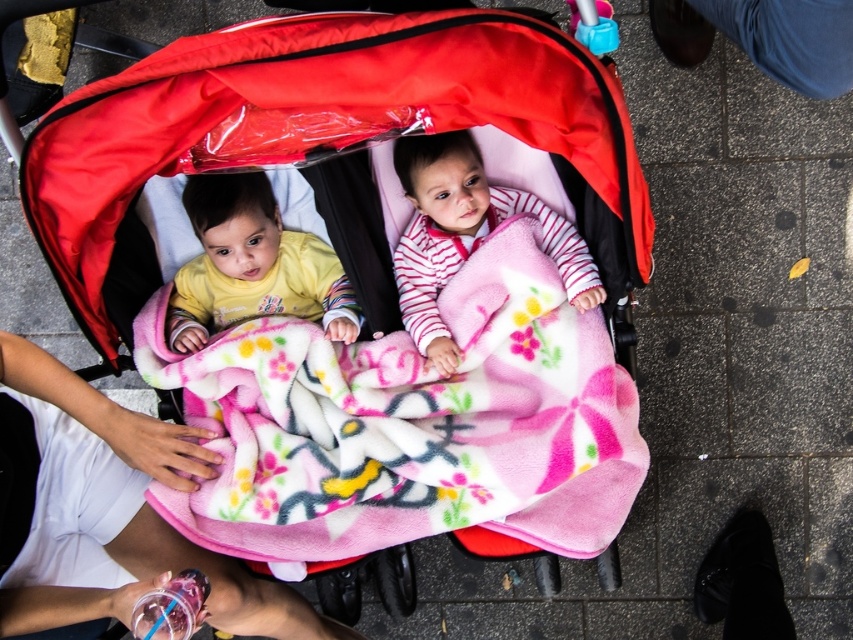
Does fluffy pink blanket at center appear on the left side of white fabric hand at lower left?

In fact, fluffy pink blanket at center is to the right of white fabric hand at lower left.

Can you confirm if fluffy pink blanket at center is positioned below white fabric hand at lower left?

Actually, fluffy pink blanket at center is above white fabric hand at lower left.

Who is more distant from viewer, (563, 404) or (154, 419)?

Positioned behind is point (563, 404).

Identify the location of fluffy pink blanket at center. (410, 422).

Is matte pink blanket at center closer to camera compared to yellow fleece toddler at upper left?

That is True.

Does point (490, 296) lie in front of point (190, 321)?

Yes, point (490, 296) is closer to viewer.

Is point (294, 481) positioned behind point (190, 344)?

No, it is not.

The height and width of the screenshot is (640, 853). I want to click on matte pink blanket at center, so click(366, 280).

Is yellow fleece toddler at upper left to the left of pink fleece blanket at center from the viewer's perspective?

Indeed, yellow fleece toddler at upper left is positioned on the left side of pink fleece blanket at center.

Does yellow fleece toddler at upper left appear over pink fleece blanket at center?

No.

Which is behind, point (206, 188) or point (412, 264)?

The point (412, 264) is more distant.

The height and width of the screenshot is (640, 853). Identify the location of yellow fleece toddler at upper left. (252, 266).